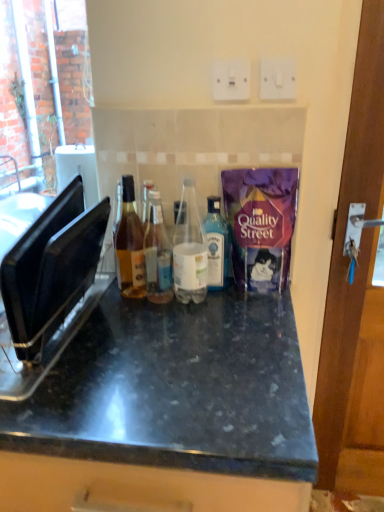
At what (x,y) coordinates should I click in order to perform the action: click on free location in front of blue glass bottle at center, the first bottle viewed from the right. Please return your answer as a coordinate pair (x, y). Looking at the image, I should click on (217, 324).